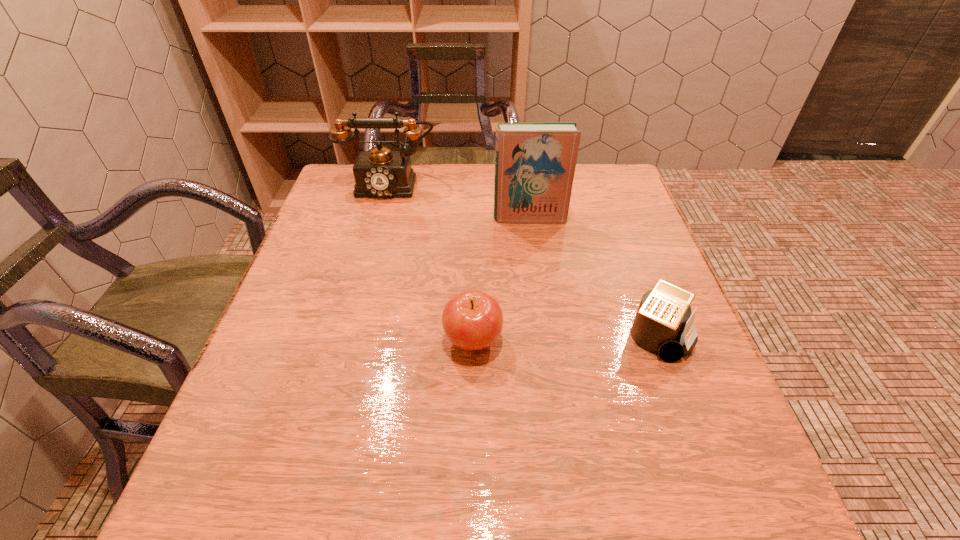
Find the location of a particular element. free space between the tallest object and the rightmost object is located at coordinates (593, 278).

Find the location of a particular element. free spot between the second farthest object and the rightmost object is located at coordinates (593, 278).

Where is `free space between the third tallest object and the calculator`? The width and height of the screenshot is (960, 540). free space between the third tallest object and the calculator is located at coordinates (564, 339).

Where is `vacant point located between the shortest object and the apple`? vacant point located between the shortest object and the apple is located at coordinates coord(564,339).

Locate an element on the screen. The image size is (960, 540). vacant area that lies between the calculator and the third shortest object is located at coordinates tap(523, 260).

Identify the location of vacant point located between the hardback book and the shortest object. This screenshot has height=540, width=960. (593, 278).

Locate an element on the screen. empty space between the shortest object and the telephone is located at coordinates (523, 260).

You are a GUI agent. You are given a task and a screenshot of the screen. Output one action in this format:
    pyautogui.click(x=<x>, y=<y>)
    Task: Click on the vacant area between the third nearest object and the shortest object
    
    Given the screenshot: What is the action you would take?
    pyautogui.click(x=593, y=278)

Locate an element on the screen. This screenshot has height=540, width=960. free space between the second shortest object and the rightmost object is located at coordinates (564, 339).

Locate an element on the screen. The height and width of the screenshot is (540, 960). object that is the second closest to the leftmost object is located at coordinates (472, 320).